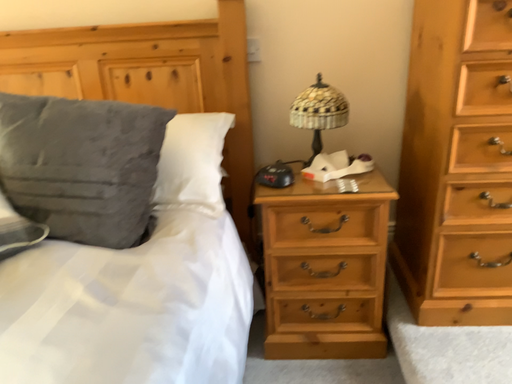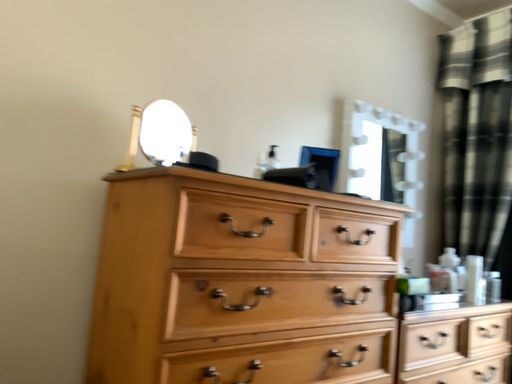
Question: Which way did the camera rotate in the video?

Choices:
 (A) rotated downward
 (B) rotated upward

Answer: (B)